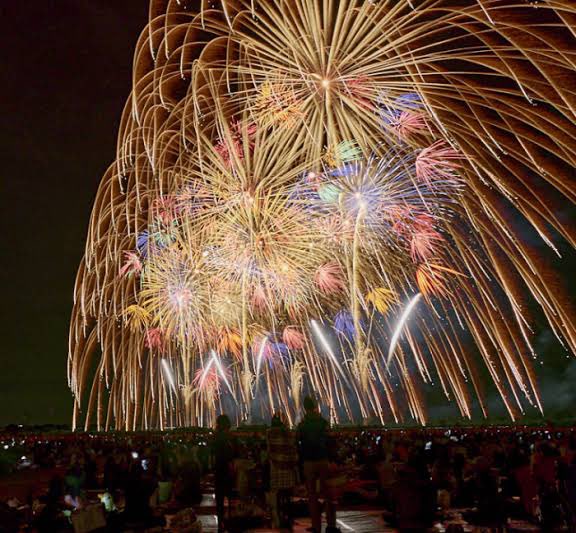
At what (x,y) coordinates should I click in order to perform the action: click on blankets. Please return your answer as a coordinate pair (x, y). Looking at the image, I should click on (210, 519), (351, 516), (376, 524).